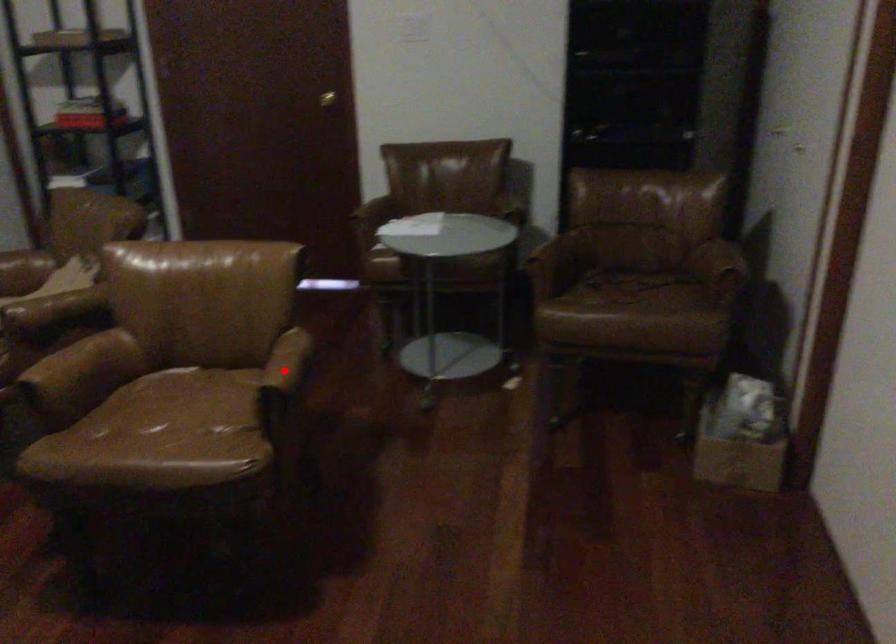
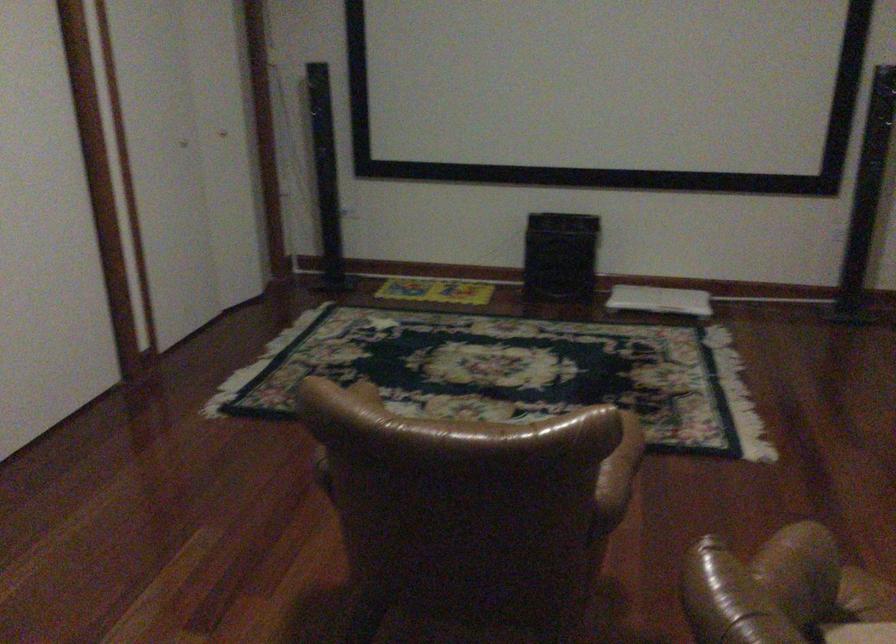
Question: I am providing you with two images of the same scene from different viewpoints. A red point is marked on the first image. At the location where the point appears in image 1, is it still visible in image 2?

Choices:
 (A) Yes
 (B) No

Answer: (B)